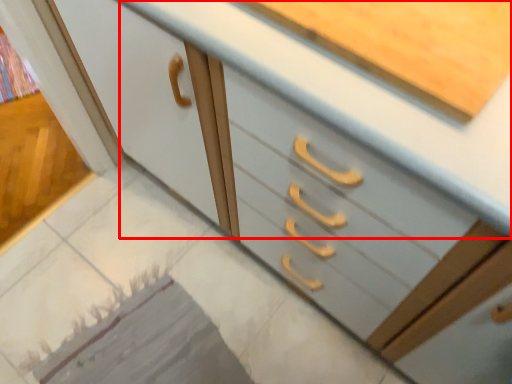
Question: Considering the relative positions of counter top (annotated by the red box) and tile in the image provided, where is counter top (annotated by the red box) located with respect to the staircase?

Choices:
 (A) right
 (B) left

Answer: (A)